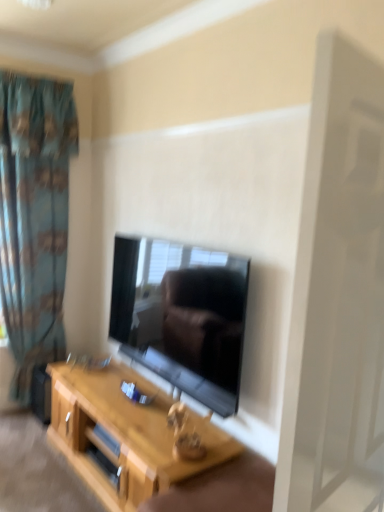
Question: Does light wood table at center turn towards black glossy tv at center?

Choices:
 (A) yes
 (B) no

Answer: (B)

Question: Is light wood table at center closer to camera compared to black glossy tv at center?

Choices:
 (A) yes
 (B) no

Answer: (A)

Question: Is light wood table at center to the right of black glossy tv at center from the viewer's perspective?

Choices:
 (A) no
 (B) yes

Answer: (A)

Question: Does light wood table at center contain black glossy tv at center?

Choices:
 (A) yes
 (B) no

Answer: (B)

Question: Can you confirm if light wood table at center is wider than black glossy tv at center?

Choices:
 (A) yes
 (B) no

Answer: (A)

Question: Considering the positions of black glossy tv at center and blue fabric curtain at left in the image, is black glossy tv at center taller or shorter than blue fabric curtain at left?

Choices:
 (A) tall
 (B) short

Answer: (B)

Question: Visually, is black glossy tv at center positioned to the left or to the right of blue fabric curtain at left?

Choices:
 (A) right
 (B) left

Answer: (A)

Question: Considering the positions of black glossy tv at center and blue fabric curtain at left in the image, is black glossy tv at center bigger or smaller than blue fabric curtain at left?

Choices:
 (A) small
 (B) big

Answer: (A)

Question: Considering the positions of black glossy tv at center and blue fabric curtain at left in the image, is black glossy tv at center wider or thinner than blue fabric curtain at left?

Choices:
 (A) thin
 (B) wide

Answer: (A)

Question: Is black glossy tv at center to the left or to the right of light wood table at center in the image?

Choices:
 (A) left
 (B) right

Answer: (B)

Question: Relative to light wood table at center, is black glossy tv at center in front or behind?

Choices:
 (A) behind
 (B) front

Answer: (A)

Question: Is point (216, 313) positioned closer to the camera than point (117, 482)?

Choices:
 (A) farther
 (B) closer

Answer: (A)

Question: Looking at their shapes, would you say black glossy tv at center is wider or thinner than light wood table at center?

Choices:
 (A) thin
 (B) wide

Answer: (A)

Question: Is blue fabric curtain at left in front of or behind black glossy tv at center in the image?

Choices:
 (A) front
 (B) behind

Answer: (B)

Question: From their relative heights in the image, would you say blue fabric curtain at left is taller or shorter than black glossy tv at center?

Choices:
 (A) tall
 (B) short

Answer: (A)